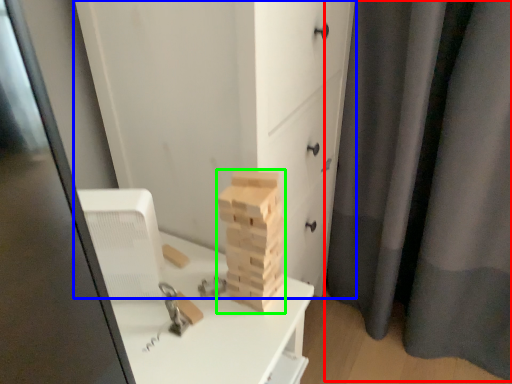
Question: Considering the real-world distances, which object is closest to curtain (highlighted by a red box)? chest of drawers (highlighted by a blue box) or drawer (highlighted by a green box).

Choices:
 (A) chest of drawers
 (B) drawer

Answer: (A)